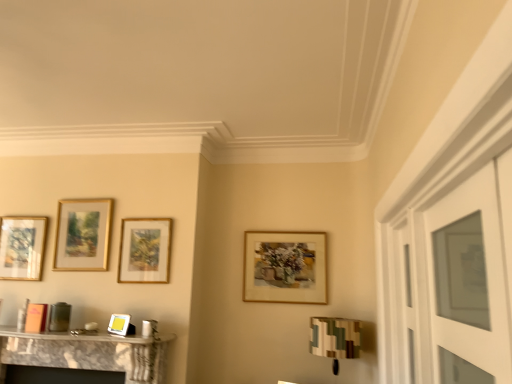
Question: In terms of width, does gold-framed picture at left, which is the 1th picture frame in left-to-right order, look wider or thinner when compared to clear glass door at right?

Choices:
 (A) wide
 (B) thin

Answer: (B)

Question: From their relative heights in the image, would you say gold-framed picture at left, which is the 1th picture frame in left-to-right order, is taller or shorter than clear glass door at right?

Choices:
 (A) short
 (B) tall

Answer: (A)

Question: Considering the real-world distances, which object is farthest from the camouflage fabric lampshade at lower right?

Choices:
 (A) gold/glossy picture frame at upper left, which is the 3th picture frame from right to left
 (B) clear glass door at right
 (C) matte gold picture frame at upper center, marked as the second picture frame in a right-to-left arrangement
 (D) gold-framed picture at left, which is the 1th picture frame in left-to-right order
 (E) wooden picture frame at center, the 4th picture frame when ordered from left to right

Answer: (D)

Question: Considering the real-world distances, which object is closest to the gold/glossy picture frame at upper left, positioned as the second picture frame in left-to-right order?

Choices:
 (A) camouflage fabric lampshade at lower right
 (B) wooden picture frame at center, the first picture frame positioned from the right
 (C) matte gold picture frame at upper center, the third picture frame from the left
 (D) clear glass door at right
 (E) gold-framed picture at left, placed as the fourth picture frame when sorted from right to left

Answer: (E)